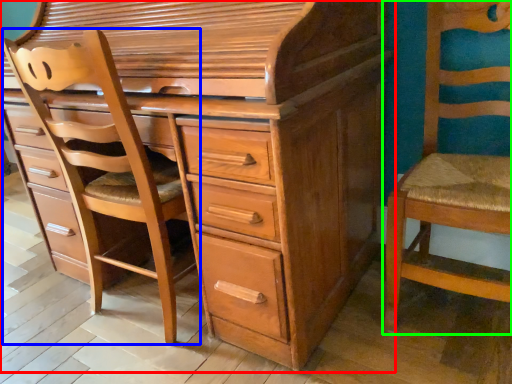
Question: Considering the real-world distances, which object is closest to chest of drawers (highlighted by a red box)? armchair (highlighted by a blue box) or chair (highlighted by a green box).

Choices:
 (A) armchair
 (B) chair

Answer: (A)